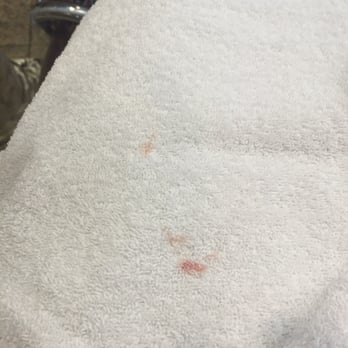
Find the location of a particular element. towel is located at coordinates (94, 77).